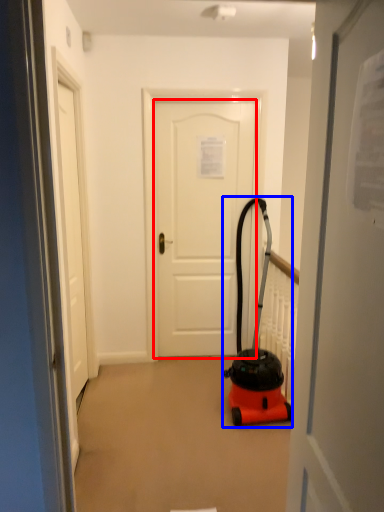
Question: Which object appears farthest to the camera in this image, door (highlighted by a red box) or equipment (highlighted by a blue box)?

Choices:
 (A) door
 (B) equipment

Answer: (A)